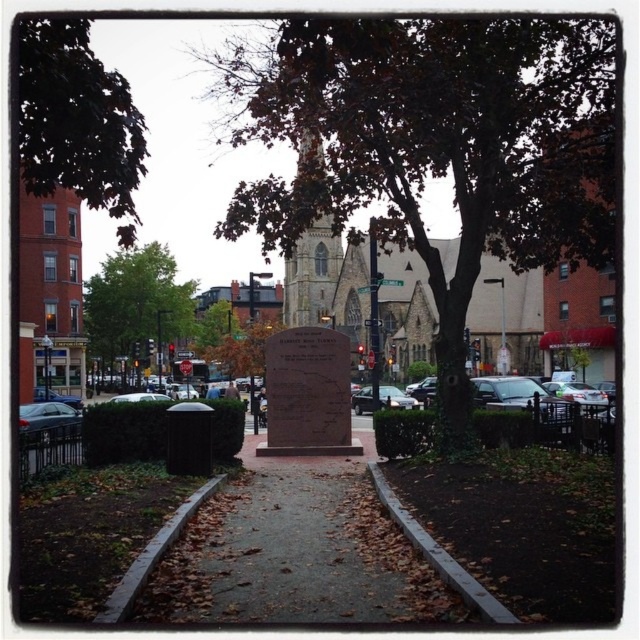
How much distance is there between brown brick church at left and silver metallic sedan at right?

The distance of brown brick church at left from silver metallic sedan at right is 282.16 feet.

Looking at this image, who is shorter, brown brick church at left or silver metallic sedan at right?

silver metallic sedan at right

Where is `brown brick church at left`? This screenshot has width=640, height=640. brown brick church at left is located at coordinates (51, 292).

Does brown textured tree at center appear on the left side of matte black sedan at left?

Incorrect, brown textured tree at center is not on the left side of matte black sedan at left.

This screenshot has width=640, height=640. Identify the location of brown textured tree at center. click(435, 147).

Between point (598, 262) and point (29, 428), which one is positioned in front?

Point (598, 262) is in front.

The height and width of the screenshot is (640, 640). In order to click on brown textured tree at center in this screenshot , I will do `click(435, 147)`.

From the picture: Can you confirm if brown textured tree at center is positioned to the left of brown stone church at center?

Indeed, brown textured tree at center is positioned on the left side of brown stone church at center.

Does brown textured tree at center appear on the right side of brown stone church at center?

Incorrect, brown textured tree at center is not on the right side of brown stone church at center.

Who is more distant from viewer, (506, 204) or (401, 260)?

The point (401, 260) is behind.

I want to click on brown textured tree at center, so click(435, 147).